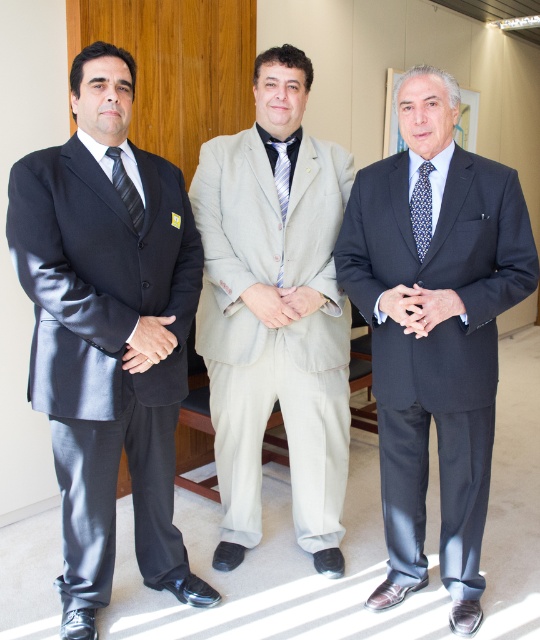
You are a photographer standing at the camera position. You want to take a closeup photo of the blue dotted tie at center. Can you reach it with your hand without moving your body?

The blue dotted tie at center is 1.79 meters away from camera, so you cannot reach it with your hand without moving your body.

You are a photographer standing in front of the matte black suit at left. You want to take a closeup photo of the suit without moving your position. Can you do that?

The matte black suit at left is 5.30 feet away from viewer. Since 5.30 feet is a reasonable distance for a closeup photo, yes, you can take a closeup photo of the matte black suit at left without moving your position.

You are a photographer setting up for a group photo. You need to ensure that the matte black suit at left and the matte black tie at left are both visible in the frame. Based on their sizes, which one is more likely to be fully captured in the photo?

The matte black suit at left is wider than the matte black tie at left, so the matte black suit at left is more likely to be fully visible in the photo.